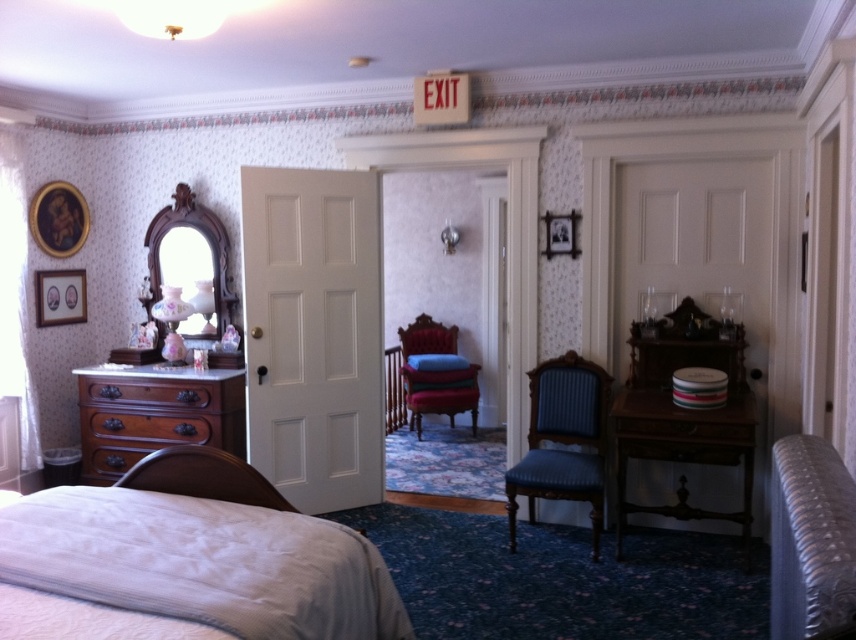
Question: Among these objects, which one is nearest to the camera?

Choices:
 (A) light gray fabric bed at lower left
 (B) mahogany wooden dresser at left

Answer: (A)

Question: Is mahogany wooden dresser at left in front of blue fabric chair at center?

Choices:
 (A) no
 (B) yes

Answer: (A)

Question: Can you confirm if blue fabric chair at center is wider than velvet red chair at center?

Choices:
 (A) no
 (B) yes

Answer: (A)

Question: Which is farther from the light gray fabric bed at lower left?

Choices:
 (A) blue fabric chair at center
 (B) velvet red chair at center
 (C) mahogany wooden dresser at left

Answer: (B)

Question: Does light gray fabric bed at lower left appear under blue fabric chair at center?

Choices:
 (A) no
 (B) yes

Answer: (A)

Question: Which point appears farthest from the camera in this image?

Choices:
 (A) (395, 593)
 (B) (81, 419)

Answer: (B)